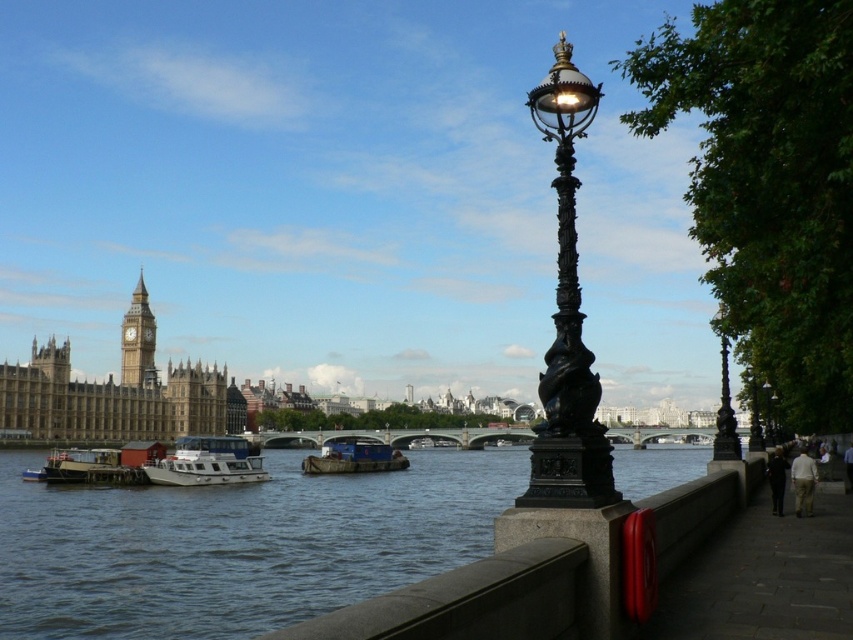
You are standing on the stone embankment near the black lamppost and want to board the white matte boat at lower left. Which direction should you walk to reach it from the blue water at center?

The blue water at center is located below the white matte boat at lower left, so you should walk towards the lower left direction to reach the boat.

You are standing on the stone embankment near the black lamppost and want to walk to the point closer to you between point (x=178, y=461) and point (x=138, y=342). Which point should you head towards?

You should head towards point (x=178, y=461) because it is closer to the viewer than point (x=138, y=342).